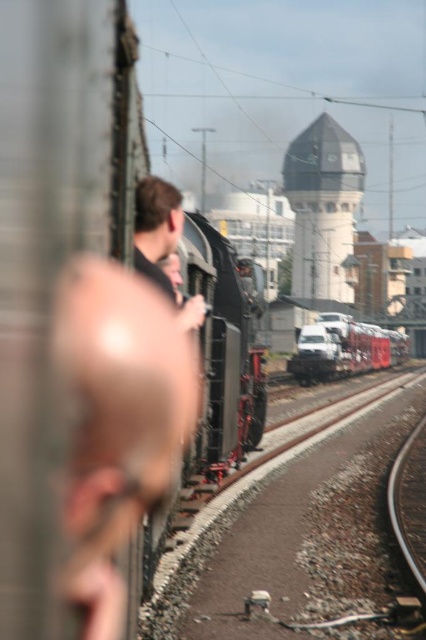
Is white glossy truck at center bigger than smooth brown hair at center?

Yes.

Is point (333, 333) farther from camera compared to point (181, 211)?

Yes.

Is point (356, 348) closer to camera compared to point (170, 184)?

No, (356, 348) is further to viewer.

This screenshot has width=426, height=640. I want to click on white glossy truck at center, so click(x=344, y=348).